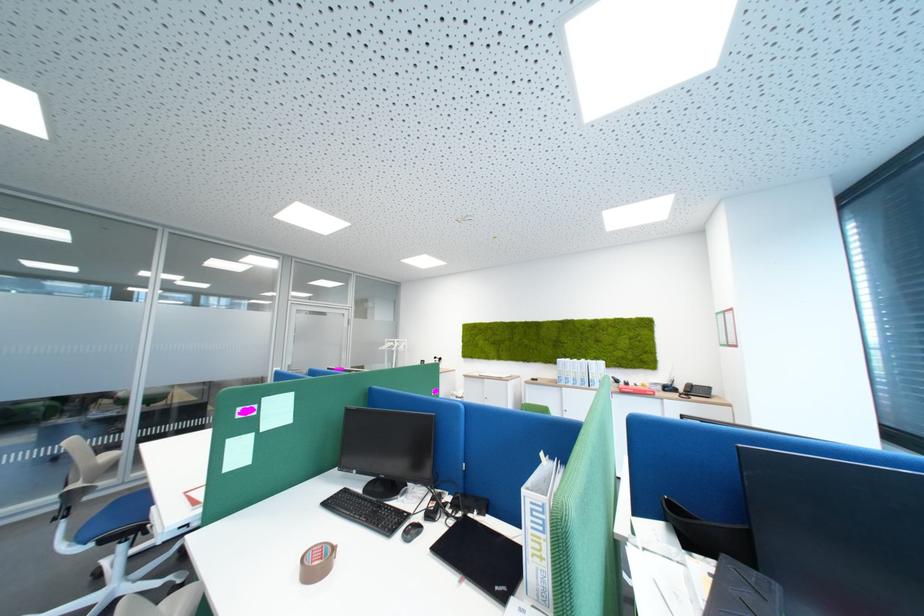
Find where to resting arm the white chair armrest. Please return your answer as a coordinate pair (x, y).

(116, 586)